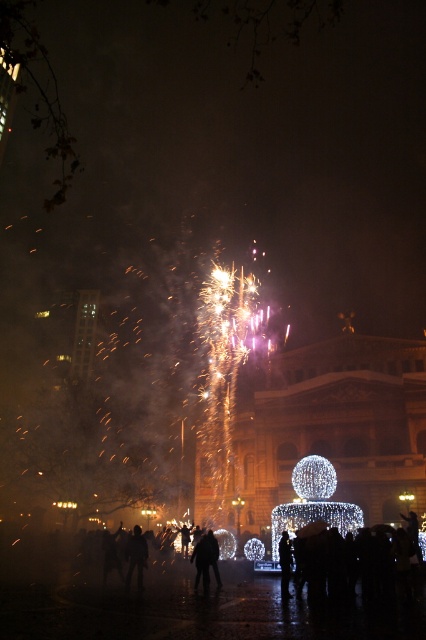
You are a photographer at the event and want to capture both the black matte person at center and the dark clothing figure at center in the same frame. However, you notice that one of them is blocking the other. Which person is being obscured by the other?

The black matte person at center is positioned over dark clothing figure at center, so the dark clothing figure at center is being obscured by the black matte person at center.

You are a photographer at the event and want to ensure both the black matte person at center and the dark clothing figure at center are fully visible in your photo. Given that your camera has a fixed focus range, which of the two might be closer to the camera?

The black matte person at center is much taller than the dark clothing figure at center, so the black matte person at center is likely closer to the camera since objects closer to the camera appear larger.